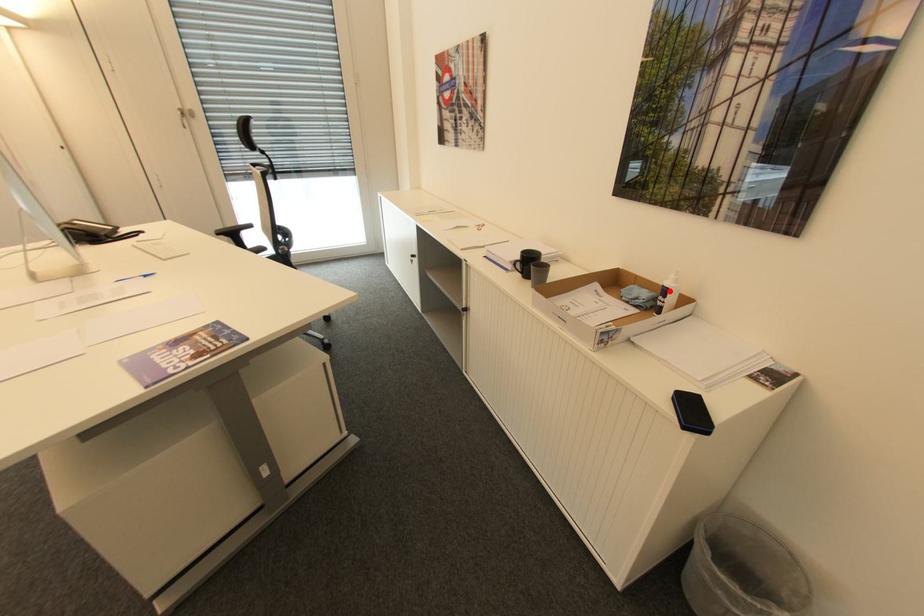
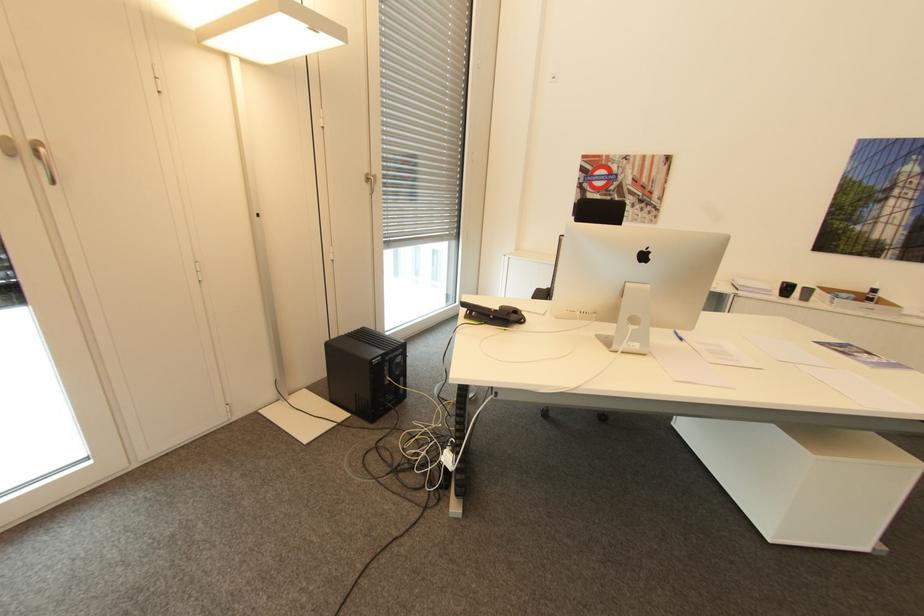
Where in the second image is the point corresponding to the highlighted location from the first image?

(879, 290)